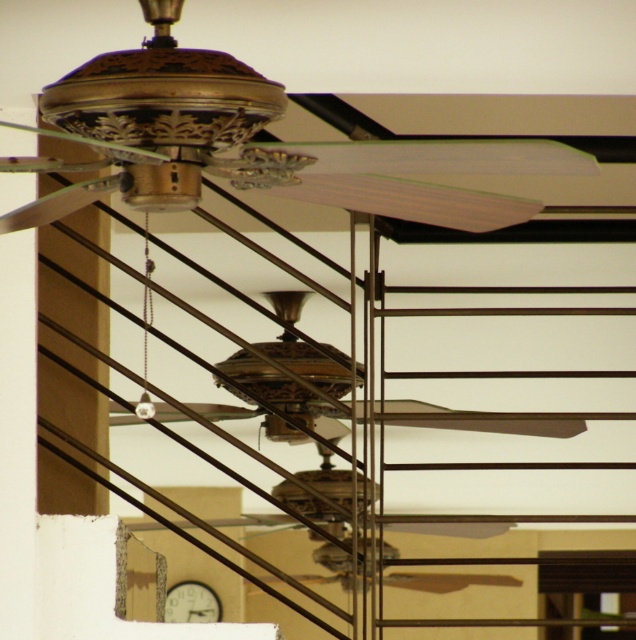
Does point (340, 410) come farther from viewer compared to point (183, 616)?

No, it is in front of (183, 616).

Between gold metallic fan at center and white wooden clock at lower center, which one is positioned lower?

white wooden clock at lower center

What do you see at coordinates (287, 369) in the screenshot? I see `gold metallic fan at center` at bounding box center [287, 369].

Find the location of a particular element. The height and width of the screenshot is (640, 636). gold metallic fan at center is located at coordinates (287, 369).

Is the position of gold metallic fan at upper center more distant than that of white wooden clock at lower center?

No, it is in front of white wooden clock at lower center.

Who is more distant from viewer, (x=467, y=228) or (x=197, y=621)?

The point (x=197, y=621) is behind.

Identify the location of gold metallic fan at upper center. This screenshot has width=636, height=640. (244, 144).

Does gold metallic fan at upper center have a lesser width compared to gold metallic fan at center?

Correct, gold metallic fan at upper center's width is less than gold metallic fan at center's.

Based on the photo, between gold metallic fan at upper center and gold metallic fan at center, which one has less height?

Standing shorter between the two is gold metallic fan at upper center.

Is point (259, 170) closer to viewer compared to point (443, 412)?

Yes, it is.

The width and height of the screenshot is (636, 640). Find the location of `gold metallic fan at upper center`. gold metallic fan at upper center is located at coordinates (244, 144).